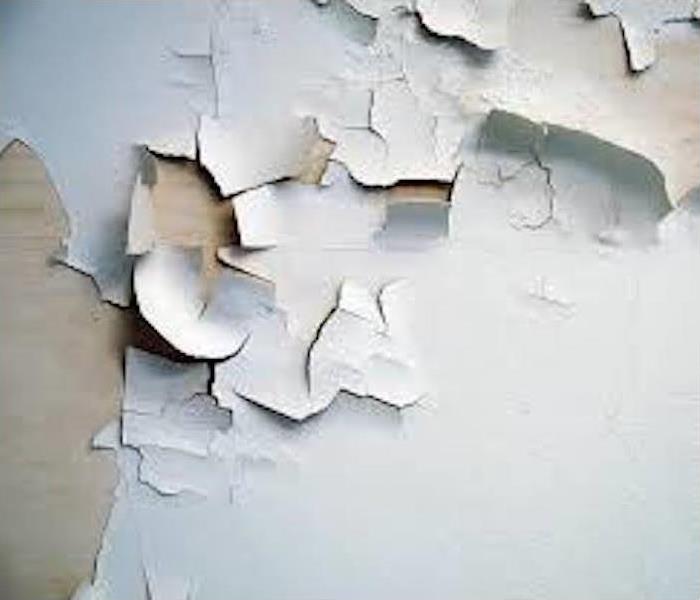
The image size is (700, 600). Identify the location of cracked wall. pyautogui.click(x=407, y=270).